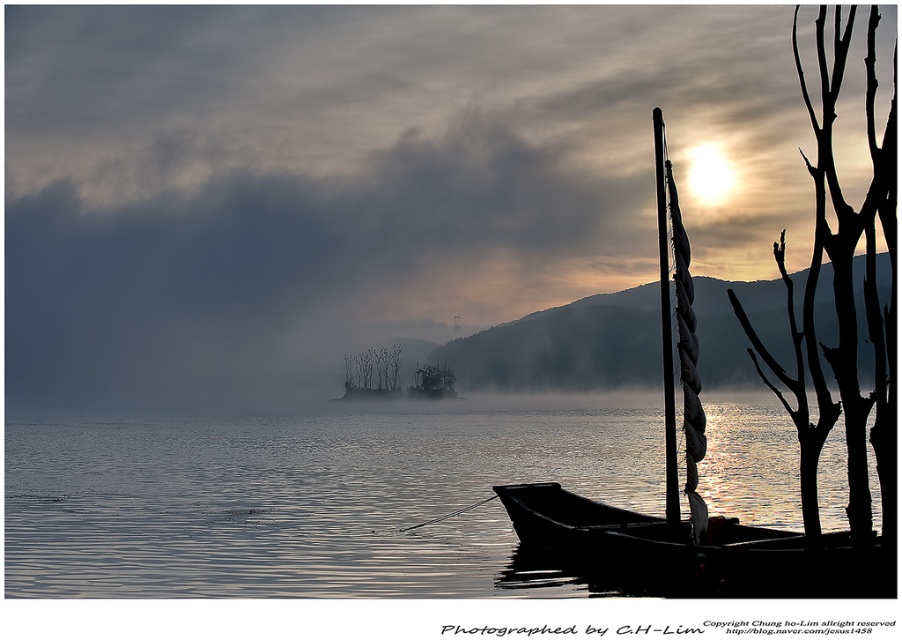
Question: Which point is closer to the camera taking this photo?

Choices:
 (A) (588, 538)
 (B) (494, 512)

Answer: (A)

Question: Which of the following is the farthest from the observer?

Choices:
 (A) transparent water at center
 (B) black wood canoe at lower right
 (C) foggy mist at center

Answer: (A)

Question: Does silvery sailboat at right have a smaller size compared to silhouette bark tree at right?

Choices:
 (A) no
 (B) yes

Answer: (B)

Question: Does silvery sailboat at right appear over silhouette bark tree at right?

Choices:
 (A) no
 (B) yes

Answer: (A)

Question: In this image, where is foggy mist at center located relative to silvery sailboat at right?

Choices:
 (A) right
 (B) left

Answer: (A)

Question: Among these objects, which one is nearest to the camera?

Choices:
 (A) black wood canoe at lower right
 (B) silhouette bark tree at right
 (C) transparent water at center
 (D) silvery sailboat at right

Answer: (B)